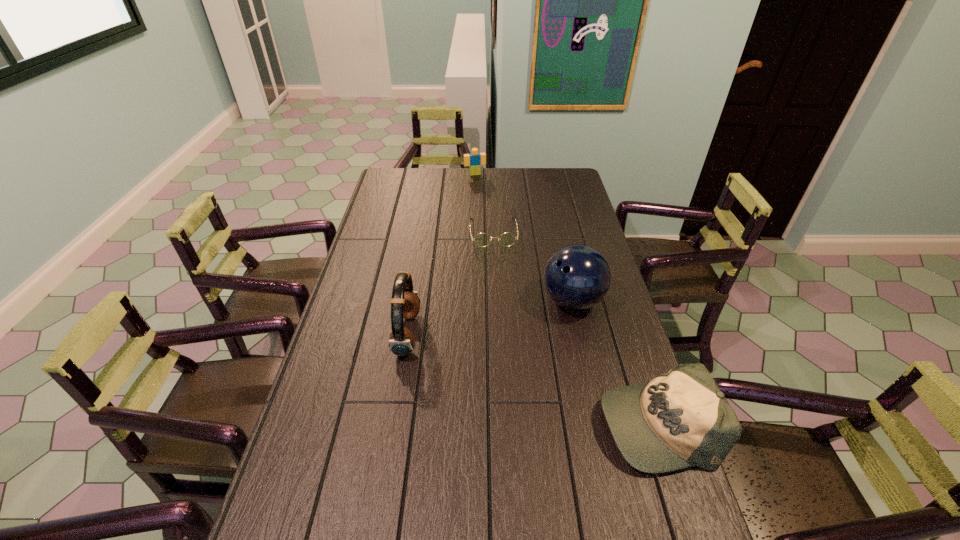
This screenshot has height=540, width=960. In order to click on headset in this screenshot , I will do `click(405, 303)`.

The width and height of the screenshot is (960, 540). I want to click on the nearest object, so click(680, 419).

This screenshot has width=960, height=540. Identify the location of bowling ball. (577, 277).

You are a GUI agent. You are given a task and a screenshot of the screen. Output one action in this format:
    pyautogui.click(x=<x>, y=<y>)
    Task: Click on the shortest object
    The width and height of the screenshot is (960, 540).
    Given the screenshot: What is the action you would take?
    pyautogui.click(x=507, y=239)

Identify the location of spectacles. Image resolution: width=960 pixels, height=540 pixels. (507, 239).

This screenshot has height=540, width=960. In order to click on Lego in this screenshot , I will do `click(475, 160)`.

Where is `vacant space located 0.130m on the ear cup of the leftmost object`? This screenshot has height=540, width=960. vacant space located 0.130m on the ear cup of the leftmost object is located at coordinates (461, 334).

Where is `vacant area situated 0.190m on the front-facing side of the nearest object`? vacant area situated 0.190m on the front-facing side of the nearest object is located at coordinates (526, 423).

The height and width of the screenshot is (540, 960). Identify the location of free space located on the front-facing side of the nearest object. (468, 423).

Find the location of a particular element. vacant space located 0.310m on the front-facing side of the nearest object is located at coordinates (480, 423).